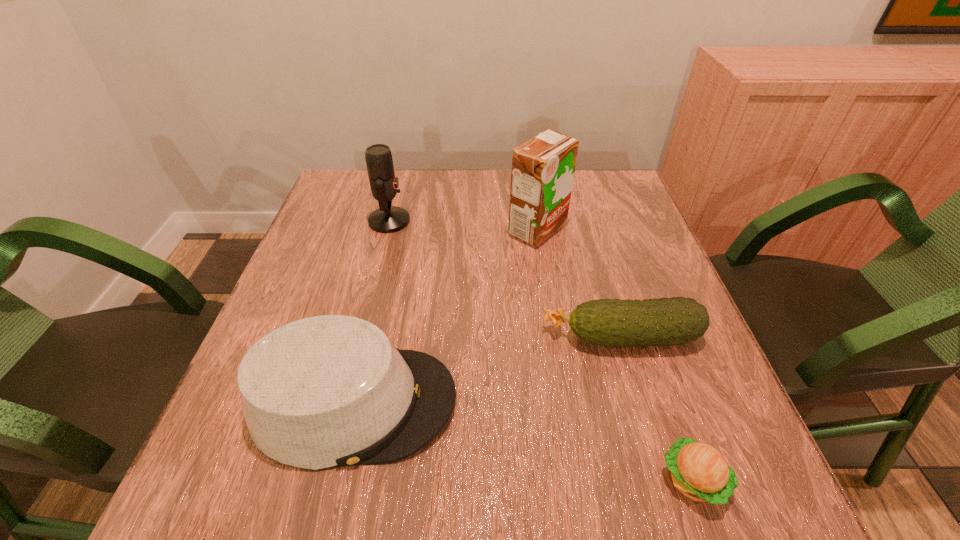
Locate an element on the screen. The image size is (960, 540). free region at the far right corner is located at coordinates (629, 198).

Where is `vacant area that lies between the third shortest object and the carton`? Image resolution: width=960 pixels, height=540 pixels. vacant area that lies between the third shortest object and the carton is located at coordinates (445, 316).

The width and height of the screenshot is (960, 540). I want to click on free point between the shortest object and the microphone, so click(541, 350).

Where is `free area in between the shortest object and the microphone`? This screenshot has height=540, width=960. free area in between the shortest object and the microphone is located at coordinates (541, 350).

Where is `vacant region between the fourth shortest object and the third shortest object`? The height and width of the screenshot is (540, 960). vacant region between the fourth shortest object and the third shortest object is located at coordinates (372, 312).

In order to click on free spot between the shortest object and the carton in this screenshot , I will do `click(615, 355)`.

Locate an element on the screen. empty space that is in between the cucumber and the second tallest object is located at coordinates (506, 279).

At what (x,y) coordinates should I click in order to perform the action: click on unoccupied position between the fourth tallest object and the second tallest object. Please return your answer as a coordinate pair (x, y). This screenshot has width=960, height=540. Looking at the image, I should click on (506, 279).

This screenshot has width=960, height=540. Identify the location of free point between the hat and the cucumber. (488, 369).

You are a GUI agent. You are given a task and a screenshot of the screen. Output one action in this format:
    pyautogui.click(x=<x>, y=<y>)
    Task: Click on the free spot between the shortest object and the carton
    The width and height of the screenshot is (960, 540).
    Given the screenshot: What is the action you would take?
    pyautogui.click(x=615, y=355)